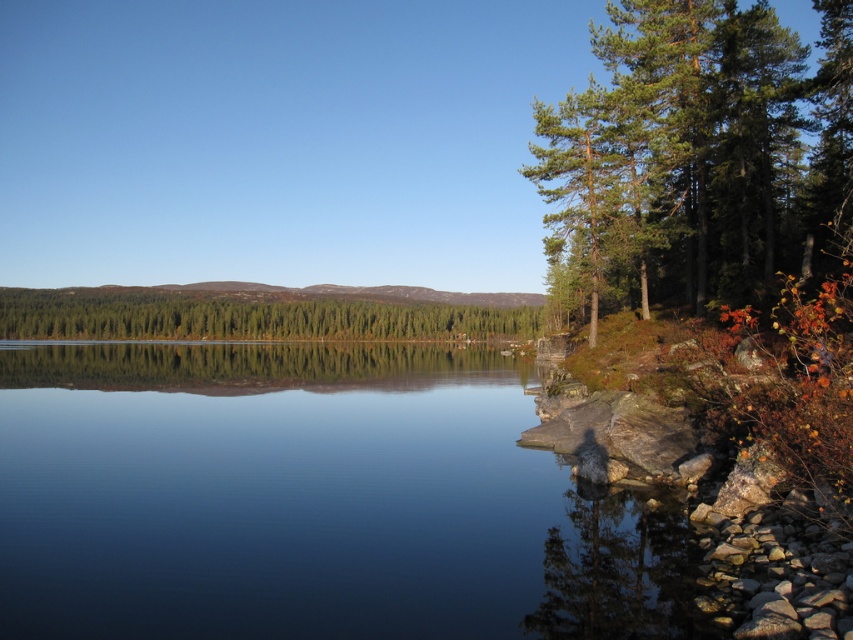
Between point (294, 483) and point (708, 260), which one is positioned behind?

Positioned behind is point (708, 260).

Who is positioned more to the left, transparent water at center or green needle-like trees at right?

From the viewer's perspective, transparent water at center appears more on the left side.

Is point (100, 609) behind point (773, 140)?

No, it is in front of (773, 140).

I want to click on transparent water at center, so click(310, 500).

Which is in front, point (439, 589) or point (416, 326)?

Point (439, 589) is in front.

Can you confirm if transparent water at center is taller than green matte forest at center?

No, transparent water at center is not taller than green matte forest at center.

Where is `transparent water at center`? The height and width of the screenshot is (640, 853). transparent water at center is located at coordinates (310, 500).

Describe the element at coordinates (694, 156) in the screenshot. This screenshot has height=640, width=853. I see `green needle-like trees at right` at that location.

Is green needle-like trees at right bigger than green matte forest at center?

Yes, green needle-like trees at right is bigger than green matte forest at center.

This screenshot has width=853, height=640. Describe the element at coordinates (694, 156) in the screenshot. I see `green needle-like trees at right` at that location.

Where is `green needle-like trees at right`? green needle-like trees at right is located at coordinates (694, 156).